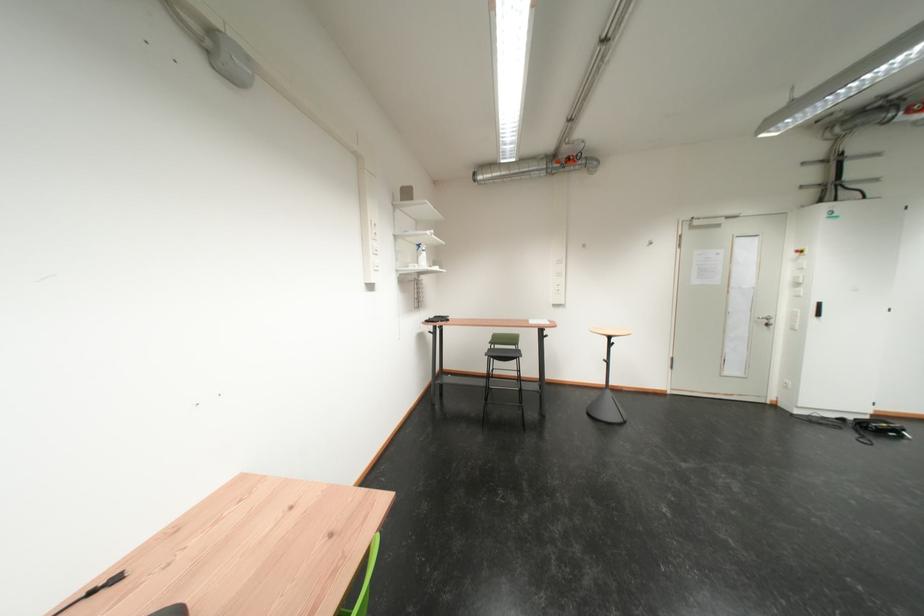
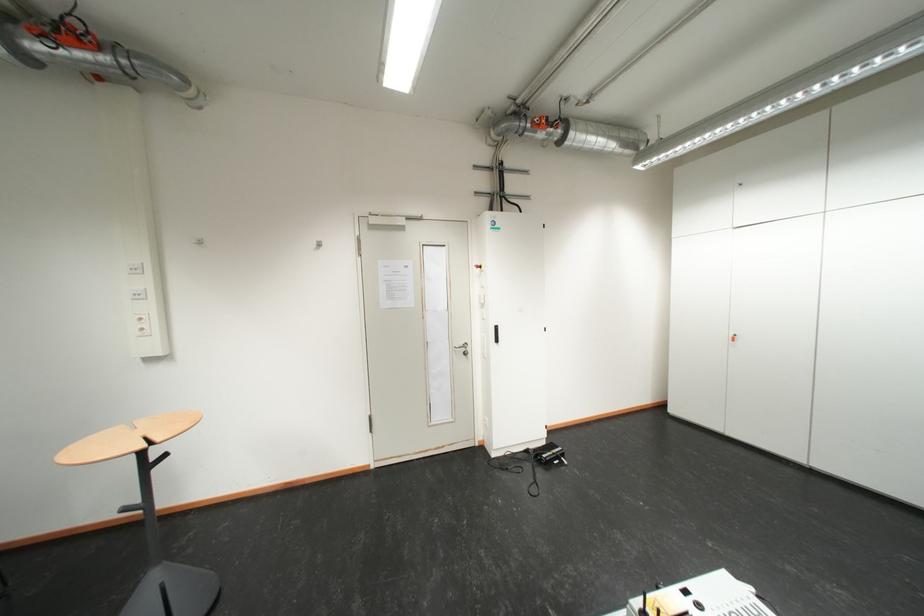
In the second image, find the point that corresponds to point (853, 422) in the first image.

(538, 454)